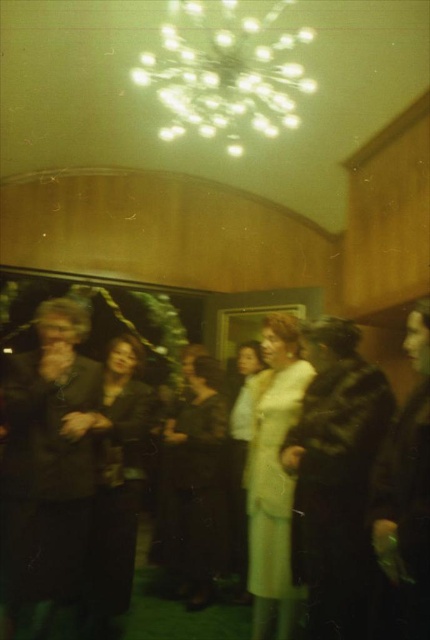
You are a photographer at this event and need to capture a photo of both the leather jacket at right and the matte black dress at center. The camera you are using has a maximum focus range of 1.5 meters. Can you fit both subjects within the camera frame without moving closer or farther away?

The leather jacket at right is 1.49 meters away from the matte black dress at center, so yes, both subjects can be captured within the camera frame since the distance between them is within the 1.5 meters focus range.